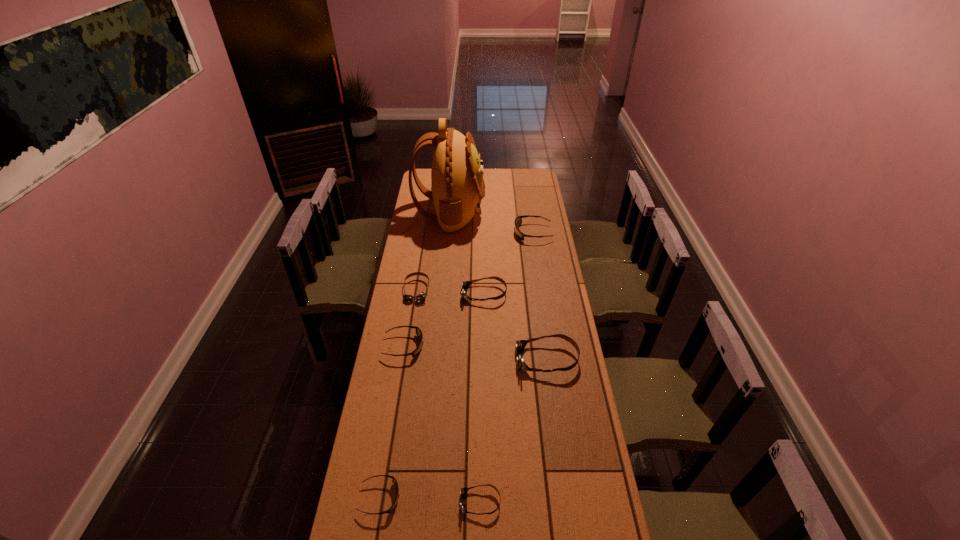
Find the location of a particular element. free space between the smallest brown goggles and the rightmost black goggles is located at coordinates (507, 368).

Identify which object is the sixth closest to the second nearest black goggles. Please provide its 2D coordinates. Your answer should be formatted as a tuple, i.e. [(x, y)], where the tuple contains the x and y coordinates of a point satisfying the conditions above.

[(458, 187)]

Locate an element on the screen. the closest object to the leftmost brown goggles is located at coordinates (465, 285).

You are a GUI agent. You are given a task and a screenshot of the screen. Output one action in this format:
    pyautogui.click(x=<x>, y=<y>)
    Task: Click on the third closest goggles relative to the smallest black goggles
    The image size is (960, 540).
    Given the screenshot: What is the action you would take?
    pyautogui.click(x=519, y=345)

Locate an element on the screen. The width and height of the screenshot is (960, 540). goggles that is the closest to the second tallest object is located at coordinates (465, 285).

You are a GUI agent. You are given a task and a screenshot of the screen. Output one action in this format:
    pyautogui.click(x=<x>, y=<y>)
    Task: Click on the brown goggles that can be found as the second closest to the smallest black goggles
    The width and height of the screenshot is (960, 540).
    Given the screenshot: What is the action you would take?
    pyautogui.click(x=519, y=345)

Identify which brown goggles is located as the third nearest to the second tallest object. Please provide its 2D coordinates. Your answer should be formatted as a tuple, i.e. [(x, y)], where the tuple contains the x and y coordinates of a point satisfying the conditions above.

[(420, 297)]

Locate an element on the screen. The width and height of the screenshot is (960, 540). black goggles that can be found as the second closest to the farthest goggles is located at coordinates (394, 480).

Locate an element on the screen. Image resolution: width=960 pixels, height=540 pixels. the closest black goggles to the nearest brown goggles is located at coordinates (394, 480).

Identify the location of vacant area in the image that satisfies the following two spatial constraints: 1. on the lenses of the farthest goggles; 2. on the front-facing side of the leftmost brown goggles. (541, 290).